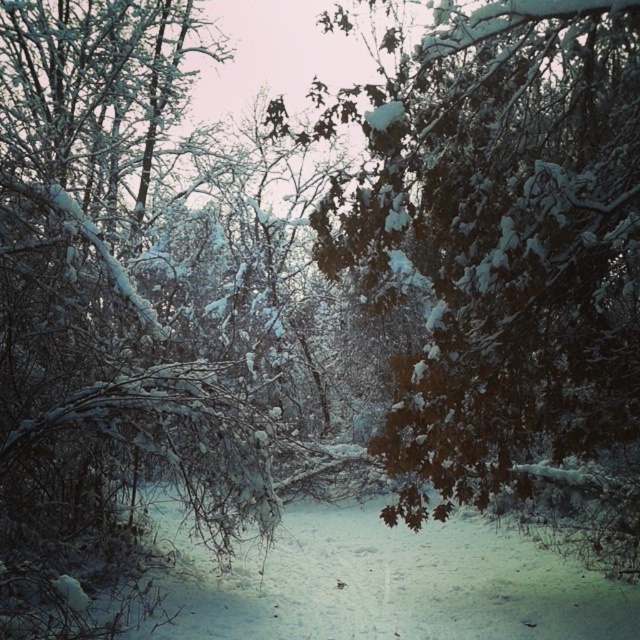
Question: Can you confirm if snow-covered branches at center is bigger than white frosty branches at left?

Choices:
 (A) yes
 (B) no

Answer: (B)

Question: Which point is closer to the camera taking this photo?

Choices:
 (A) (410, 140)
 (B) (138, 83)

Answer: (A)

Question: Does snow-covered branches at center have a greater width compared to white frosty branches at left?

Choices:
 (A) no
 (B) yes

Answer: (A)

Question: Which object is closer to the camera taking this photo?

Choices:
 (A) snow-covered branches at center
 (B) white frosty branches at left

Answer: (B)

Question: Is snow-covered branches at center above white frosty branches at left?

Choices:
 (A) no
 (B) yes

Answer: (B)